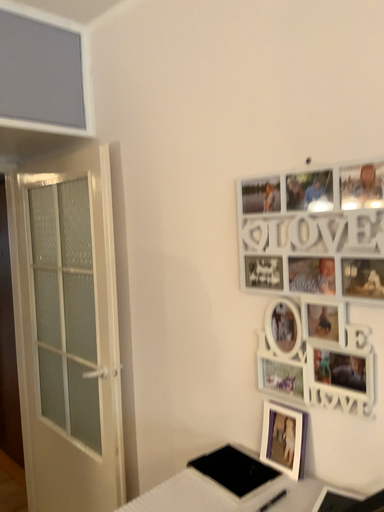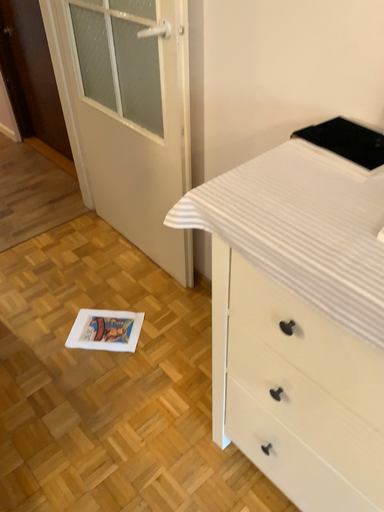
Question: How did the camera likely rotate when shooting the video?

Choices:
 (A) rotated upward
 (B) rotated downward

Answer: (B)